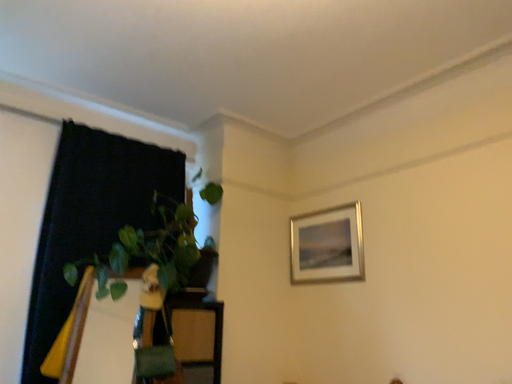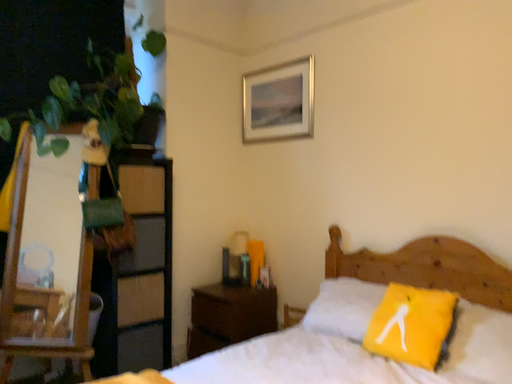
Question: Which way did the camera rotate in the video?

Choices:
 (A) rotated upward
 (B) rotated downward

Answer: (B)